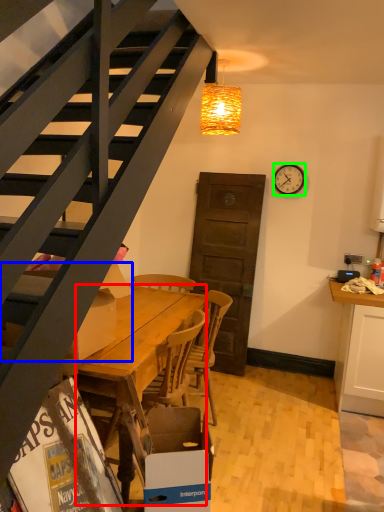
Question: Which object is positioned closest to desk (highlighted by a red box)? Select from box (highlighted by a blue box) and clock (highlighted by a green box).

Choices:
 (A) box
 (B) clock

Answer: (A)